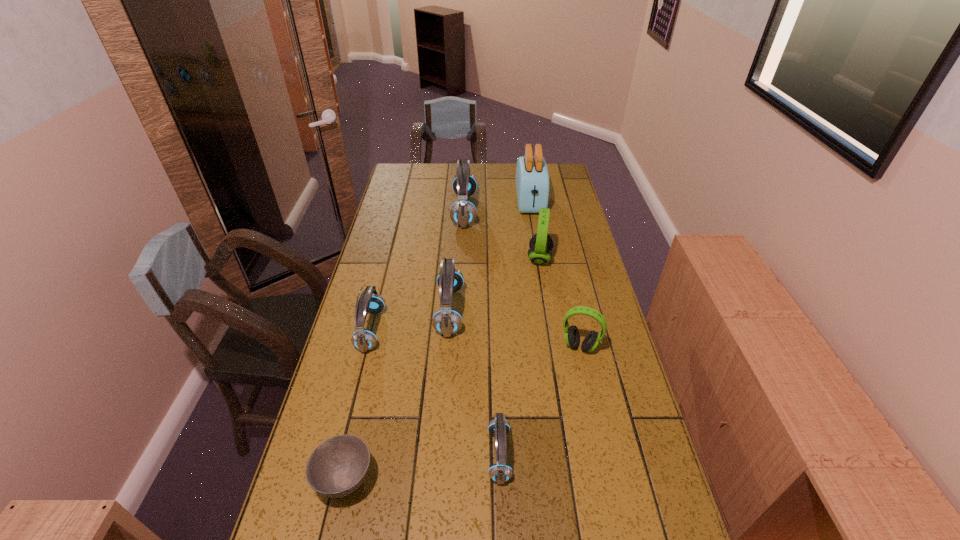
Identify which object is the fourth nearest to the third biggest blue headset. Please provide its 2D coordinates. Your answer should be formatted as a tuple, i.e. [(x, y)], where the tuple contains the x and y coordinates of a point satisfying the conditions above.

[(463, 213)]

Where is `headset that stands as the second closest to the fourth object from right to left`? headset that stands as the second closest to the fourth object from right to left is located at coordinates (446, 321).

Where is `headset that is the second closest to the fifth object from left to right`? This screenshot has width=960, height=540. headset that is the second closest to the fifth object from left to right is located at coordinates (446, 321).

Locate an element on the screen. Image resolution: width=960 pixels, height=540 pixels. blue headset that can be found as the third closest to the bigger green headset is located at coordinates (363, 339).

Select which blue headset is the third closest to the tallest object. Please provide its 2D coordinates. Your answer should be formatted as a tuple, i.e. [(x, y)], where the tuple contains the x and y coordinates of a point satisfying the conditions above.

[(363, 339)]

Identify the location of vacant region that satisfies the following two spatial constraints: 1. on the front side of the nearer green headset; 2. on the ear cups of the nearest headset. (604, 455).

You are a GUI agent. You are given a task and a screenshot of the screen. Output one action in this format:
    pyautogui.click(x=<x>, y=<y>)
    Task: Click on the vacant space that satisfies the following two spatial constraints: 1. on the side of the light toaster with the lever; 2. on the ear cups of the farthest headset
    The image size is (960, 540).
    Given the screenshot: What is the action you would take?
    pyautogui.click(x=532, y=210)

Find the location of `vacant space that satisfies the following two spatial constraints: 1. on the ear cups of the second smallest blue headset; 2. on the left side of the shortest object`. vacant space that satisfies the following two spatial constraints: 1. on the ear cups of the second smallest blue headset; 2. on the left side of the shortest object is located at coordinates (333, 479).

Image resolution: width=960 pixels, height=540 pixels. I want to click on free space in the image that satisfies the following two spatial constraints: 1. on the back side of the nearer green headset; 2. on the ear cups of the third smallest blue headset, so (572, 311).